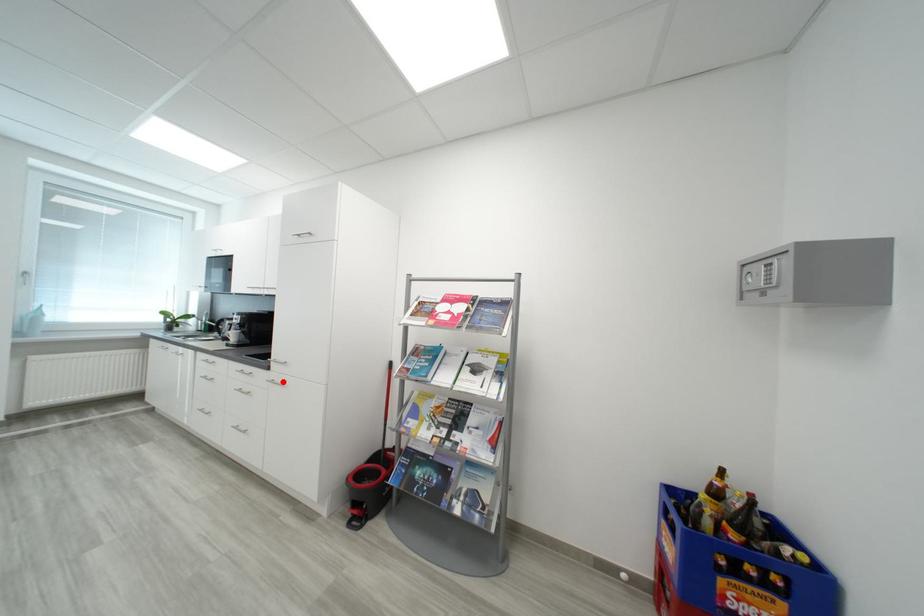
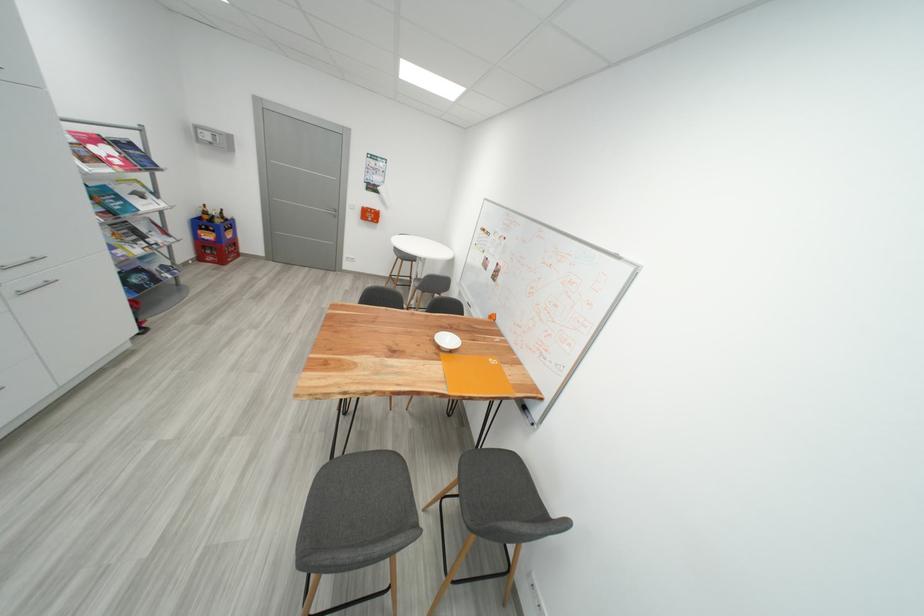
Question: I am providing you with two images of the same scene from different viewpoints. Image1 has a red point marked. In image2, the corresponding 3D location appears at what relative position? Reply with the corresponding letter.

Choices:
 (A) Closer
 (B) Farther

Answer: (B)